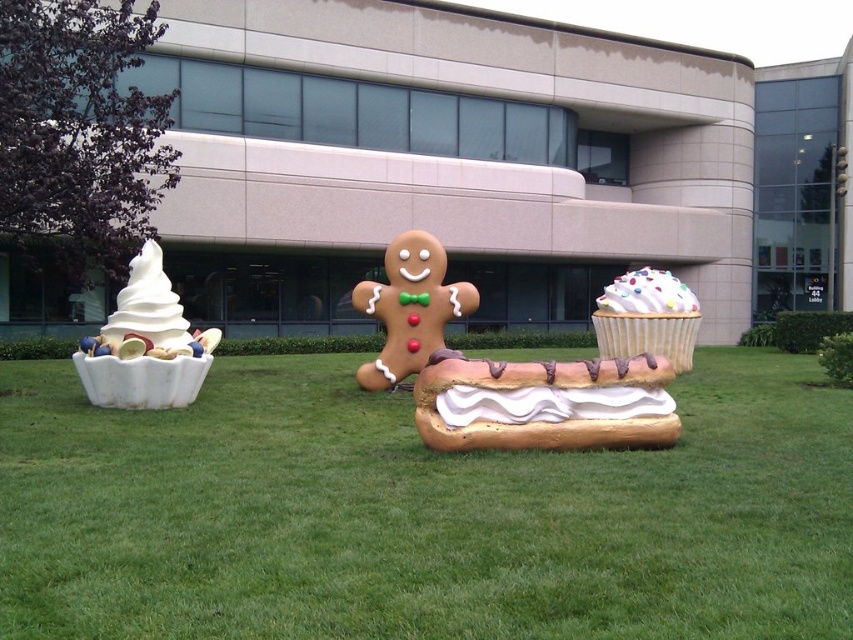
Question: Which point is farther to the camera?

Choices:
 (A) white matte hot dog at center
 (B) white frosted cupcake at center

Answer: (B)

Question: Is the position of white glossy frosting at center less distant than that of white glossy cupcake at center right?

Choices:
 (A) no
 (B) yes

Answer: (B)

Question: Which point is farther to the camera?

Choices:
 (A) white matte ice cream at left
 (B) green grass at center
 (C) white frosted cupcake at center

Answer: (C)

Question: Which object is farther from the camera taking this photo?

Choices:
 (A) white matte ice cream at left
 (B) green grass at center

Answer: (A)

Question: Is white matte hot dog at center further to camera compared to white glossy frosting at center?

Choices:
 (A) yes
 (B) no

Answer: (A)

Question: Is white matte ice cream cone at left wider than white matte ice cream at left?

Choices:
 (A) no
 (B) yes

Answer: (B)